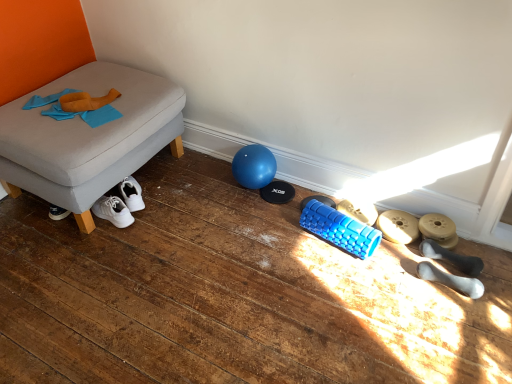
In order to click on blank space situated above blue rubber roller at lower center, the fifth footwear positioned from the front (from a real-world perspective) in this screenshot , I will do pos(360,210).